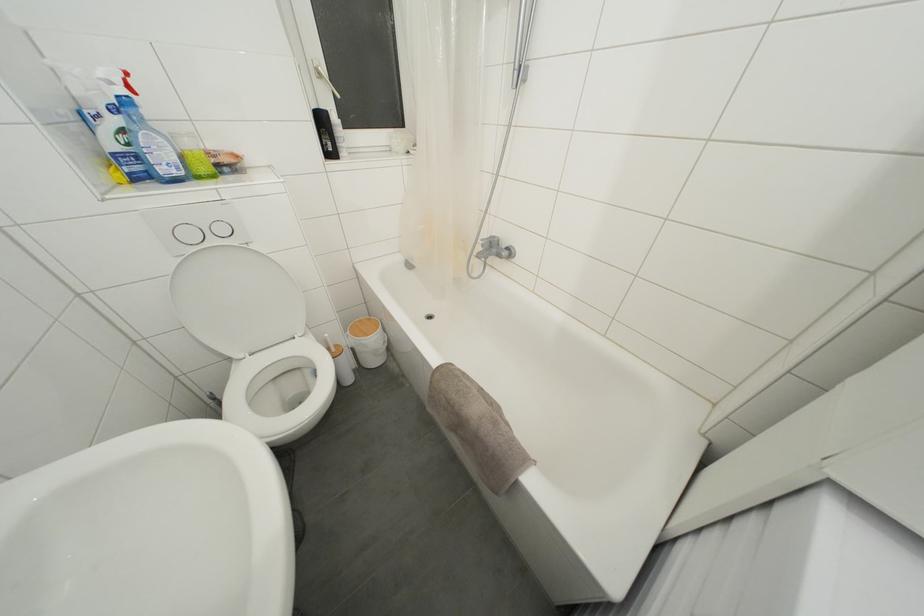
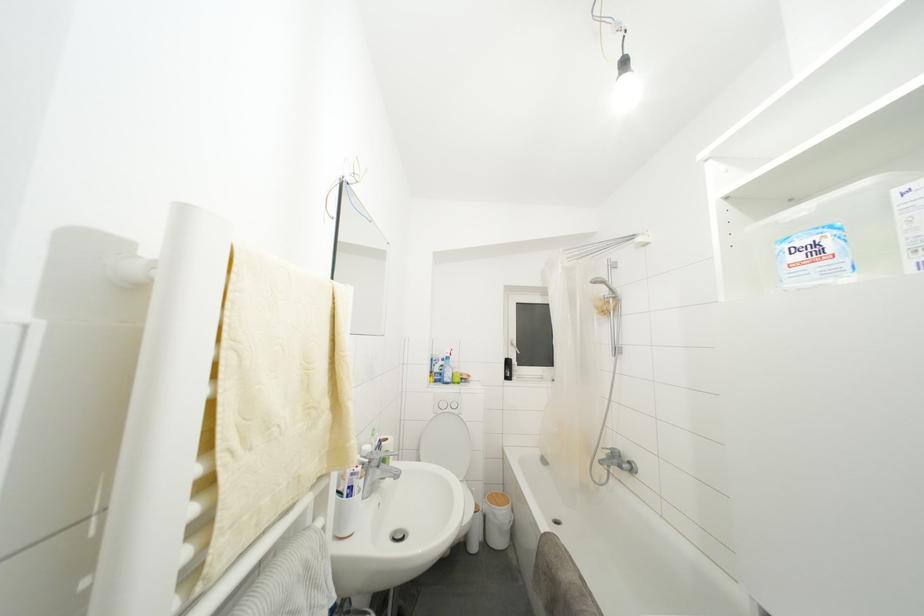
Based on the continuous images, in which direction is the camera rotating?

The rotation direction of the camera is left-up.